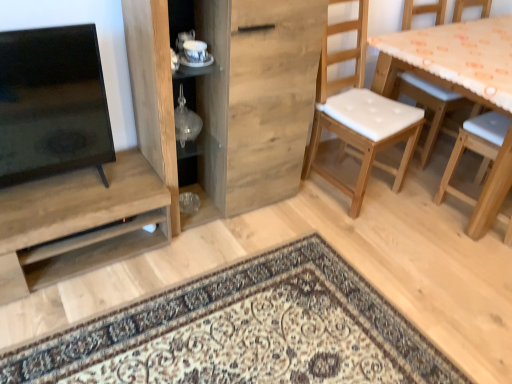
Question: Considering the relative sizes of wooden cabinet at center and transparent glass vase at center, which is the 2th shelf from bottom to top, in the image provided, is wooden cabinet at center smaller than transparent glass vase at center, which is the 2th shelf from bottom to top,?

Choices:
 (A) yes
 (B) no

Answer: (B)

Question: Is wooden cabinet at center aimed at transparent glass vase at center, acting as the first shelf starting from the top?

Choices:
 (A) no
 (B) yes

Answer: (B)

Question: Is wooden cabinet at center turned away from transparent glass vase at center, which appears as the first shelf when viewed from the right?

Choices:
 (A) yes
 (B) no

Answer: (A)

Question: Does wooden cabinet at center lie in front of transparent glass vase at center, acting as the first shelf starting from the top?

Choices:
 (A) no
 (B) yes

Answer: (B)

Question: Considering the relative sizes of wooden cabinet at center and transparent glass vase at center, which appears as the first shelf when viewed from the right, in the image provided, is wooden cabinet at center thinner than transparent glass vase at center, which appears as the first shelf when viewed from the right,?

Choices:
 (A) no
 (B) yes

Answer: (A)

Question: Can you confirm if wooden cabinet at center is bigger than transparent glass vase at center, which is the 2th shelf from left to right?

Choices:
 (A) no
 (B) yes

Answer: (B)

Question: Does matte wood shelf at left, placed as the 1th shelf when sorted from bottom to top, touch wooden cabinet at center?

Choices:
 (A) yes
 (B) no

Answer: (B)

Question: Is matte wood shelf at left, arranged as the 2th shelf when viewed from the top, shorter than wooden cabinet at center?

Choices:
 (A) yes
 (B) no

Answer: (A)

Question: Considering the relative sizes of matte wood shelf at left, acting as the 1th shelf starting from the left, and wooden cabinet at center in the image provided, is matte wood shelf at left, acting as the 1th shelf starting from the left, wider than wooden cabinet at center?

Choices:
 (A) no
 (B) yes

Answer: (B)

Question: From a real-world perspective, is matte wood shelf at left, acting as the 1th shelf starting from the left, located higher than wooden cabinet at center?

Choices:
 (A) yes
 (B) no

Answer: (B)

Question: Is matte wood shelf at left, arranged as the 2th shelf when viewed from the top, positioned beyond the bounds of wooden cabinet at center?

Choices:
 (A) yes
 (B) no

Answer: (A)

Question: From the image's perspective, is matte wood shelf at left, placed as the 1th shelf when sorted from bottom to top, below wooden cabinet at center?

Choices:
 (A) no
 (B) yes

Answer: (B)

Question: Can you confirm if wooden table with orange patterned cloth at right is thinner than white padded wood chair at right?

Choices:
 (A) no
 (B) yes

Answer: (B)